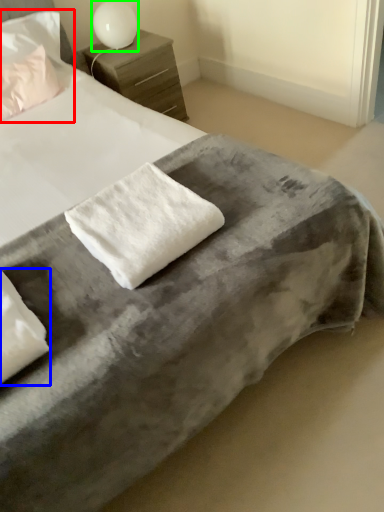
Question: Which is nearer to the pillow (highlighted by a red box)? pillow (highlighted by a blue box) or table lamp (highlighted by a green box).

Choices:
 (A) pillow
 (B) table lamp

Answer: (B)